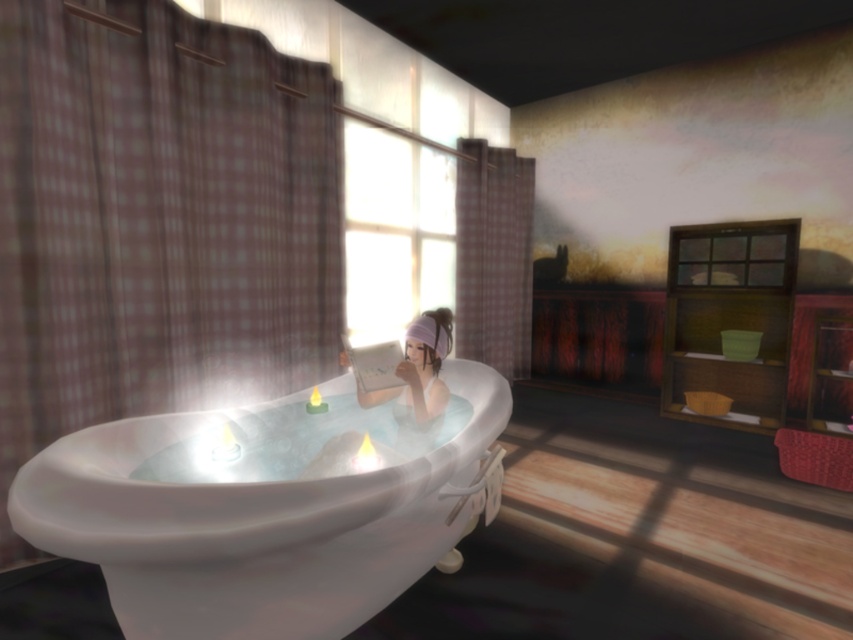
Which is more to the left, white glossy bathtub at center or white glossy hairband at center?

white glossy bathtub at center

Locate an element on the screen. white glossy bathtub at center is located at coordinates (263, 508).